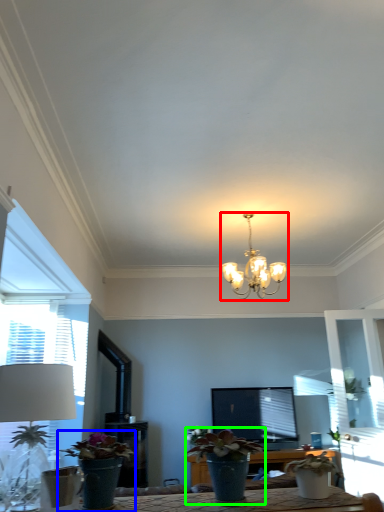
Question: Which object is positioned closest to lamp (highlighted by a red box)? Select from houseplant (highlighted by a blue box) and houseplant (highlighted by a green box).

Choices:
 (A) houseplant
 (B) houseplant

Answer: (B)